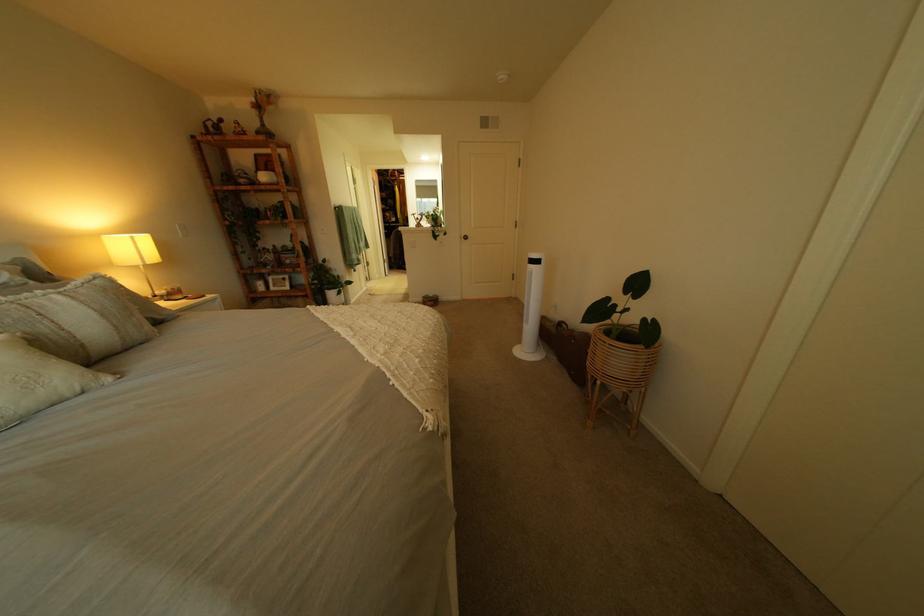
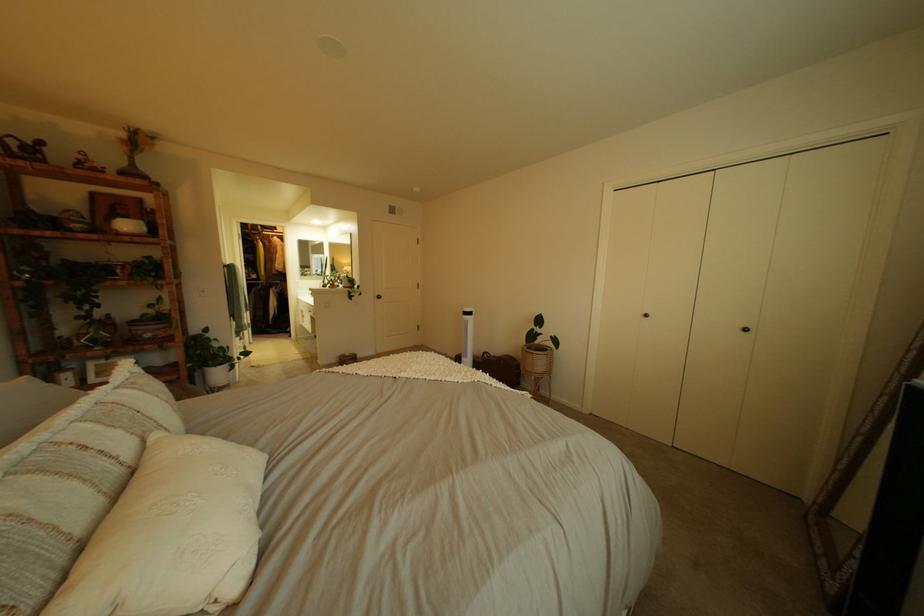
Locate, in the second image, the point that corresponds to the point at 300,246 in the first image.

(161, 315)